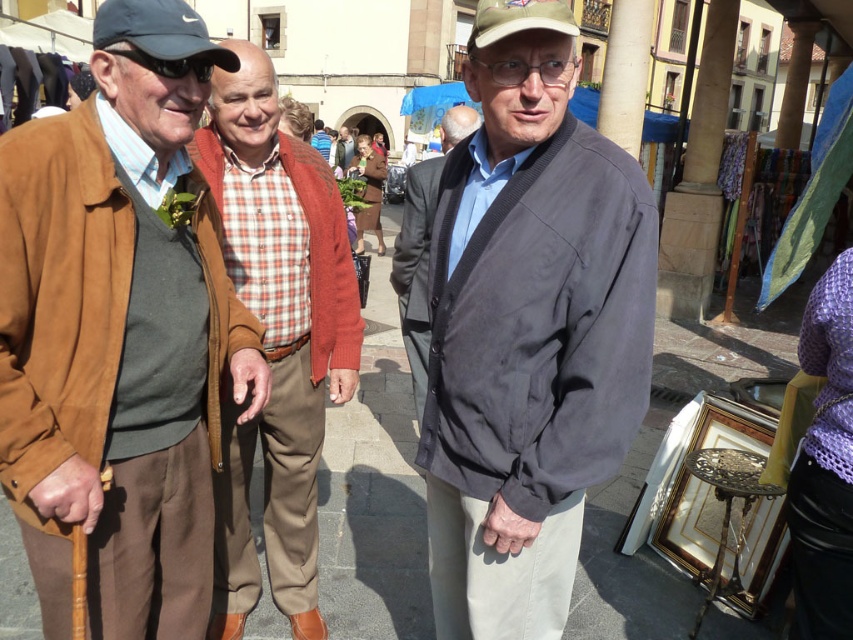
Question: Observing the image, what is the correct spatial positioning of brown suede jacket at left in reference to dark gray suede jacket at center?

Choices:
 (A) right
 (B) left

Answer: (B)

Question: Which point appears farthest from the camera in this image?

Choices:
 (A) (418, 241)
 (B) (206, 211)
 (C) (527, 81)
 (D) (248, 97)

Answer: (D)

Question: Estimate the real-world distances between objects in this image. Which object is closer to the brown suede jacket at left?

Choices:
 (A) dark gray suede jacket at center
 (B) dark gray suit at center

Answer: (A)

Question: Can you confirm if brown suede jacket at left is positioned to the right of checkered fabric shirt at center?

Choices:
 (A) no
 (B) yes

Answer: (A)

Question: Which of the following is the closest to the observer?

Choices:
 (A) dark gray suit at center
 (B) dark gray suede jacket at center

Answer: (B)

Question: Can you confirm if brown suede jacket at left is positioned to the left of dark gray suede jacket at center?

Choices:
 (A) yes
 (B) no

Answer: (A)